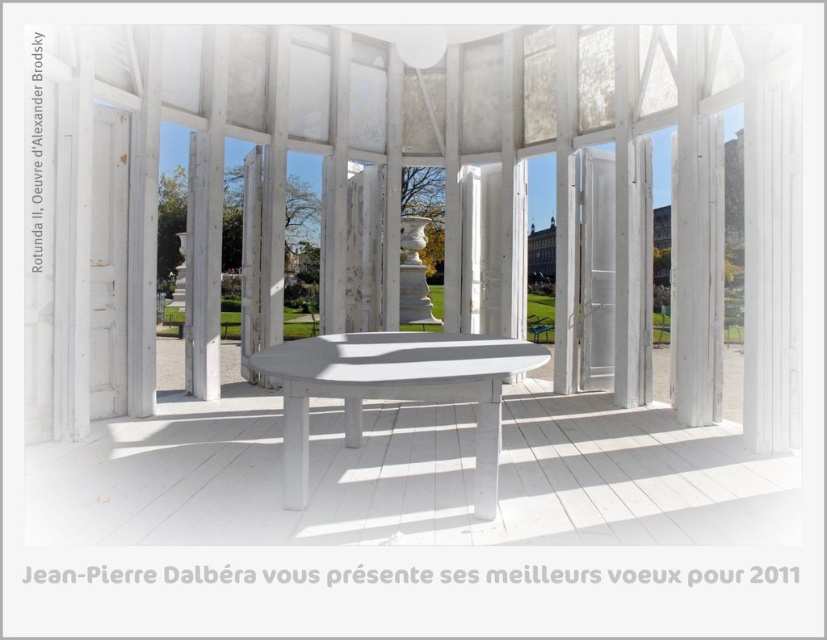
Is white wood window at center shorter than white painted wood table at center?

No, white wood window at center is not shorter than white painted wood table at center.

Find the location of `white wood window at center`. white wood window at center is located at coordinates (399, 195).

Between point (270, 291) and point (460, 344), which one is positioned behind?

The point (270, 291) is more distant.

Find the location of `white wood window at center`. white wood window at center is located at coordinates (399, 195).